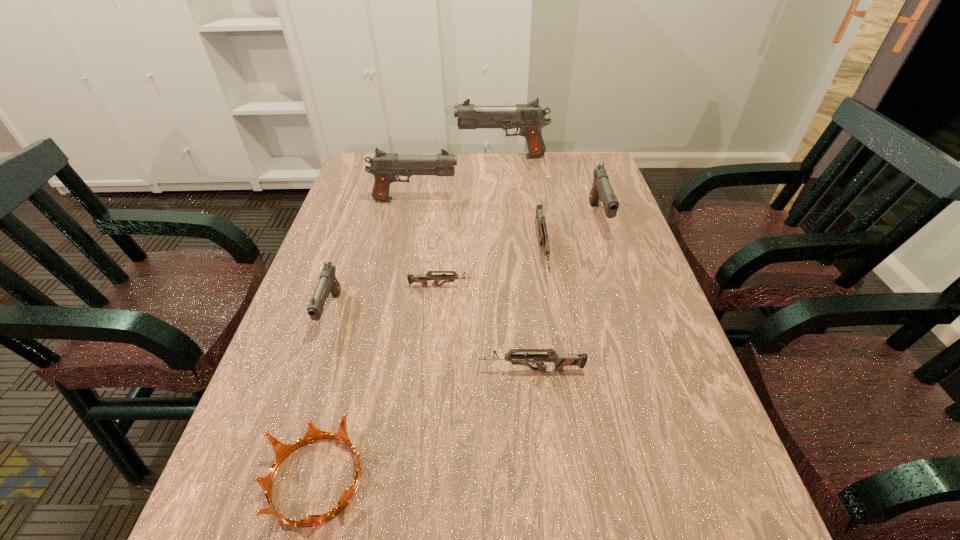
Locate an element on the screen. The height and width of the screenshot is (540, 960). free region located 0.080m in the direction the nearest gray gun is aimed is located at coordinates (311, 369).

Where is `vacant space situated aimed along the barrel of the biggest grey gun`? This screenshot has width=960, height=540. vacant space situated aimed along the barrel of the biggest grey gun is located at coordinates (568, 410).

Find the location of a particular element. free space located 0.250m on the right of the gold crown is located at coordinates (512, 479).

You are a GUI agent. You are given a task and a screenshot of the screen. Output one action in this format:
    pyautogui.click(x=<x>, y=<y>)
    Task: Click on the vacant point located aimed along the barrel of the second nearest object
    The image size is (960, 540).
    Given the screenshot: What is the action you would take?
    pyautogui.click(x=372, y=370)

Locate an element on the screen. Image resolution: width=960 pixels, height=540 pixels. free space located 0.250m aimed along the barrel of the second nearest object is located at coordinates (357, 370).

The height and width of the screenshot is (540, 960). Find the location of `vacant space located aimed along the barrel of the second nearest object`. vacant space located aimed along the barrel of the second nearest object is located at coordinates (309, 370).

Locate an element on the screen. blank area located 0.370m aimed along the barrel of the shortest object is located at coordinates (624, 286).

Find the location of a particular element. The image size is (960, 540). object positioned at the far edge is located at coordinates (530, 118).

Where is `object that is at the near edge`? Image resolution: width=960 pixels, height=540 pixels. object that is at the near edge is located at coordinates (281, 450).

You are a GUI agent. You are given a task and a screenshot of the screen. Output one action in this format:
    pyautogui.click(x=<x>, y=<y>)
    Task: Click on the crown located in the left edge section of the desktop
    The width and height of the screenshot is (960, 540).
    Given the screenshot: What is the action you would take?
    pyautogui.click(x=281, y=450)